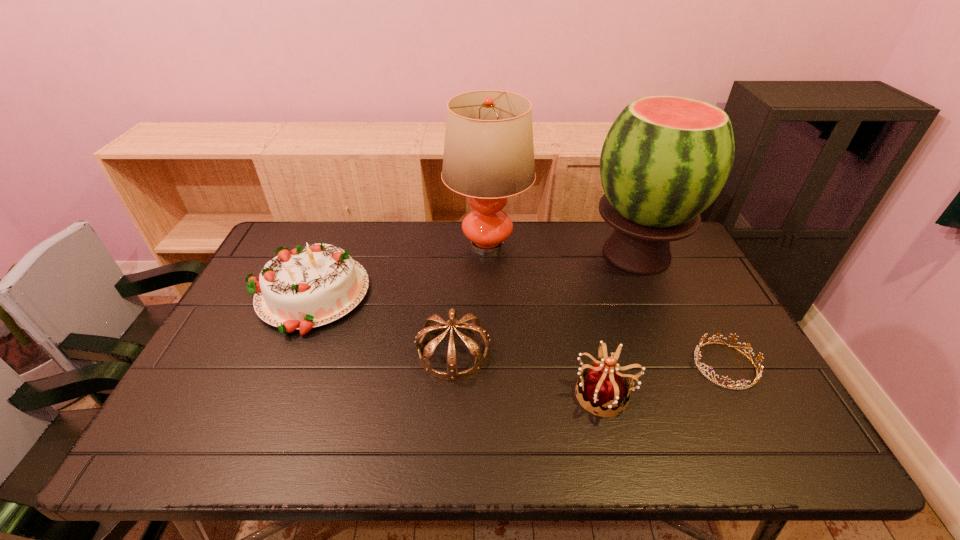
This screenshot has height=540, width=960. I want to click on vacant region located 0.100m on the front of the lamp, so click(x=489, y=294).

Where is `free region located 0.200m on the left of the watermelon`? This screenshot has width=960, height=540. free region located 0.200m on the left of the watermelon is located at coordinates (525, 254).

This screenshot has width=960, height=540. Find the location of `vacant region located on the right of the cake`. vacant region located on the right of the cake is located at coordinates click(x=458, y=295).

This screenshot has height=540, width=960. I want to click on vacant region located on the front-facing side of the tallest tiara, so click(498, 394).

At what (x,y) coordinates should I click in order to perform the action: click on vacant area situated 0.370m on the front-facing side of the tallest tiara. Please return your answer as a coordinate pair (x, y). Looking at the image, I should click on (419, 394).

I want to click on vacant area located on the front-facing side of the tallest tiara, so click(518, 394).

Image resolution: width=960 pixels, height=540 pixels. In order to click on vacant point located on the right of the leftmost tiara in this screenshot , I will do `click(555, 352)`.

Locate an element on the screen. This screenshot has height=540, width=960. free space located 0.050m on the front-facing side of the shortest tiara is located at coordinates (674, 365).

At what (x,y) coordinates should I click in order to perform the action: click on blank space located on the front-facing side of the shortest tiara. Please return your answer as a coordinate pair (x, y). Looking at the image, I should click on (603, 365).

Find the location of a particular element. The width and height of the screenshot is (960, 540). free space located 0.120m on the front-facing side of the shortest tiara is located at coordinates (646, 365).